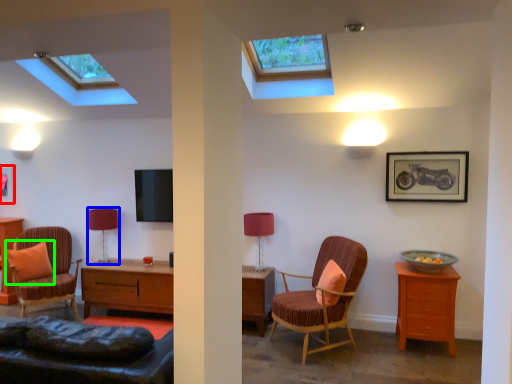
Question: Which object is the farthest from picture frame (highlighted by a red box)? Choose among these: table lamp (highlighted by a blue box) or pillow (highlighted by a green box).

Choices:
 (A) table lamp
 (B) pillow

Answer: (A)